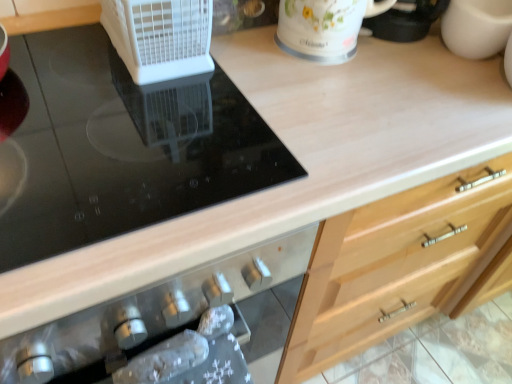
Question: Considering the positions of white floral mug at upper center and black glass cooktop at upper left in the image, is white floral mug at upper center taller or shorter than black glass cooktop at upper left?

Choices:
 (A) short
 (B) tall

Answer: (B)

Question: In terms of size, does white floral mug at upper center appear bigger or smaller than black glass cooktop at upper left?

Choices:
 (A) big
 (B) small

Answer: (B)

Question: Estimate the real-world distances between objects in this image. Which object is closer to the white plastic fan at upper left?

Choices:
 (A) black glass cooktop at upper left
 (B) white floral mug at upper center

Answer: (A)

Question: Which of these objects is positioned closest to the white plastic fan at upper left?

Choices:
 (A) white floral mug at upper center
 (B) black glass cooktop at upper left

Answer: (B)